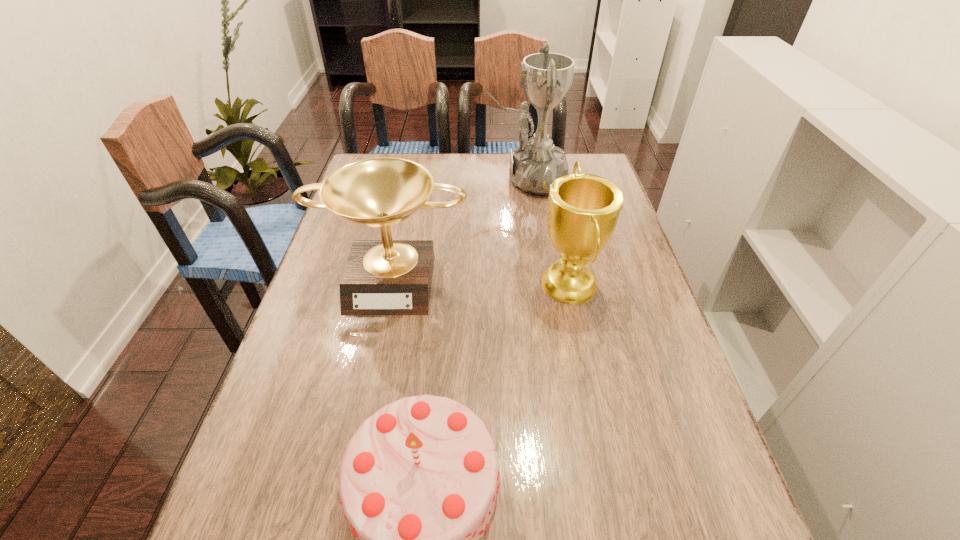
Find the location of a particular element. Image resolution: width=960 pixels, height=540 pixels. vacant space at the far edge of the desktop is located at coordinates (420, 165).

In the image, there is a desktop. At what (x,y) coordinates should I click in order to perform the action: click on vacant space at the left edge. Please return your answer as a coordinate pair (x, y). Looking at the image, I should click on (343, 224).

Identify the location of free point at the right edge. (672, 345).

You are a GUI agent. You are given a task and a screenshot of the screen. Output one action in this format:
    pyautogui.click(x=<x>, y=<y>)
    Task: Click on the vacant area that lies between the farthest object and the leftmost award
    
    Given the screenshot: What is the action you would take?
    pyautogui.click(x=460, y=228)

The width and height of the screenshot is (960, 540). What are the coordinates of `object that is the second closest to the tallest object` in the screenshot? It's located at (381, 277).

Identify which object is the closest to the birthday cake. Please provide its 2D coordinates. Your answer should be formatted as a tuple, i.e. [(x, y)], where the tuple contains the x and y coordinates of a point satisfying the conditions above.

[(583, 210)]

The height and width of the screenshot is (540, 960). Identify the location of award object that ranks as the second closest to the farthest award. (381, 277).

Select which award is the closest to the farthest award. Please provide its 2D coordinates. Your answer should be formatted as a tuple, i.e. [(x, y)], where the tuple contains the x and y coordinates of a point satisfying the conditions above.

[(583, 210)]